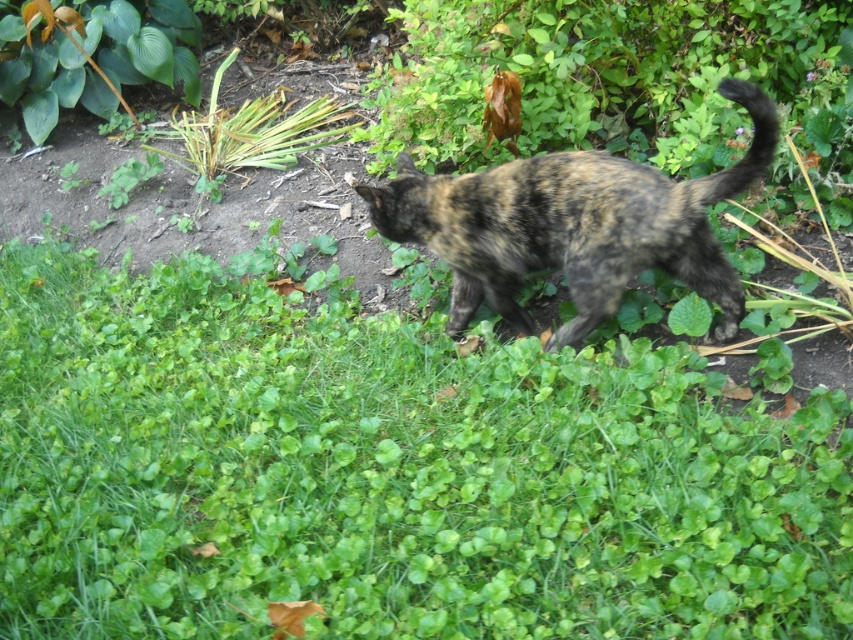
Question: Which object is positioned farthest from the green leafy plant at upper left?

Choices:
 (A) green leafy grass at center
 (B) tortoiseshell fur cat at center

Answer: (B)

Question: Can you confirm if tortoiseshell fur cat at center is positioned to the right of green leafy plant at upper left?

Choices:
 (A) no
 (B) yes

Answer: (B)

Question: Which point is farther to the camera?

Choices:
 (A) green leafy plant at upper left
 (B) tortoiseshell fur cat at center
 (C) green leafy grass at center

Answer: (A)

Question: Does green leafy grass at center have a smaller size compared to tortoiseshell fur cat at center?

Choices:
 (A) yes
 (B) no

Answer: (B)

Question: Estimate the real-world distances between objects in this image. Which object is closer to the green leafy plant at upper left?

Choices:
 (A) green leafy grass at center
 (B) tortoiseshell fur cat at center

Answer: (A)

Question: Is tortoiseshell fur cat at center to the left of green leafy plant at upper left from the viewer's perspective?

Choices:
 (A) no
 (B) yes

Answer: (A)